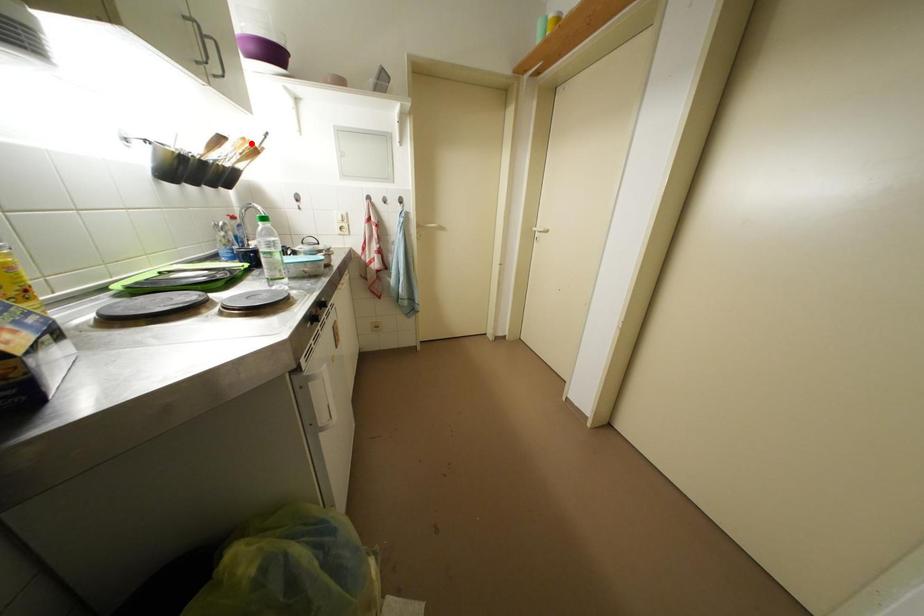
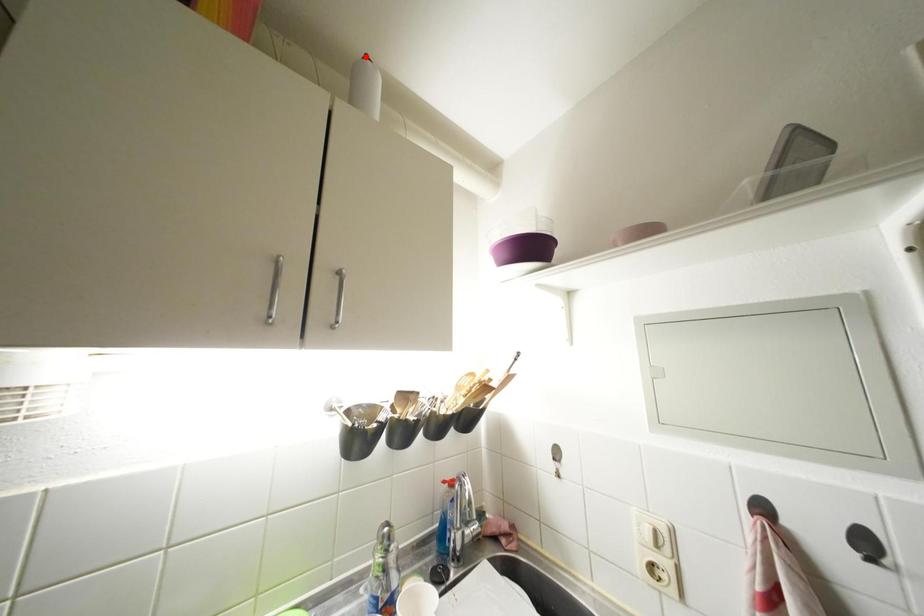
I am providing you with two images of the same scene from different viewpoints. A red point is marked on the first image and another point is marked on the second image. Do the highlighted points in image1 and image2 indicate the same real-world spot?

No